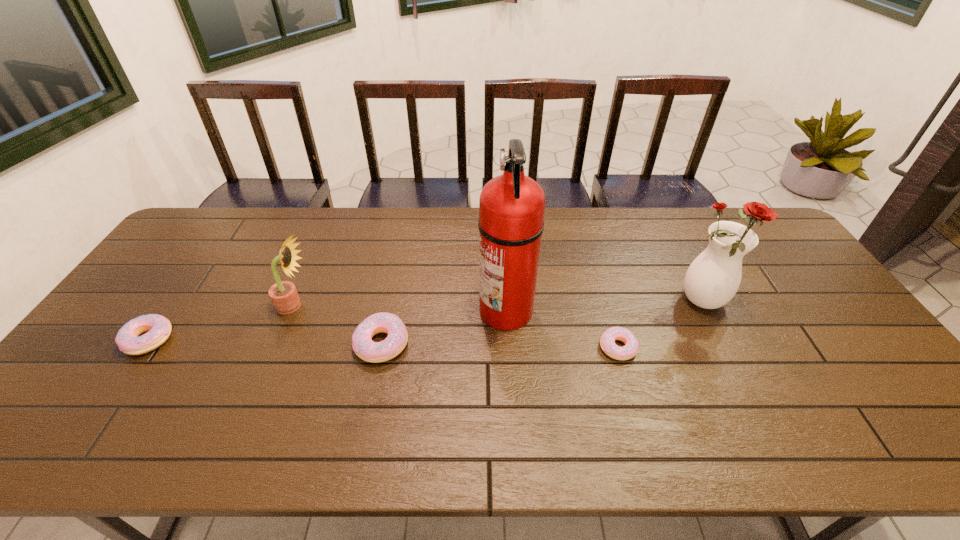
Identify the location of vacant point located between the leftmost doughnut and the third shortest object. (265, 341).

Locate an element on the screen. The image size is (960, 540). vacant area that lies between the fourth object from left to right and the second shortest doughnut is located at coordinates (327, 325).

Locate an element on the screen. The height and width of the screenshot is (540, 960). free space that is in between the rightmost object and the tallest object is located at coordinates (606, 306).

Identify which object is located as the nearest to the tallest object. Please provide its 2D coordinates. Your answer should be formatted as a tuple, i.e. [(x, y)], where the tuple contains the x and y coordinates of a point satisfying the conditions above.

[(607, 341)]

The height and width of the screenshot is (540, 960). Find the location of `object that stands as the fifth closest to the leftmost doughnut`. object that stands as the fifth closest to the leftmost doughnut is located at coordinates (713, 278).

I want to click on doughnut that can be found as the closest to the tallest doughnut, so click(128, 339).

Select which doughnut is the second closest to the second doughnut from right to left. Please provide its 2D coordinates. Your answer should be formatted as a tuple, i.e. [(x, y)], where the tuple contains the x and y coordinates of a point satisfying the conditions above.

[(607, 341)]

Where is `free space that satisfies the following two spatial constraints: 1. at the nozzle of the tallest object; 2. on the right side of the rightmost doughnut`? This screenshot has width=960, height=540. free space that satisfies the following two spatial constraints: 1. at the nozzle of the tallest object; 2. on the right side of the rightmost doughnut is located at coordinates (508, 347).

The height and width of the screenshot is (540, 960). What are the coordinates of `free location that satisfies the following two spatial constraints: 1. at the nozzle of the fourth object from left to right; 2. on the back side of the shortest object` in the screenshot? It's located at (508, 347).